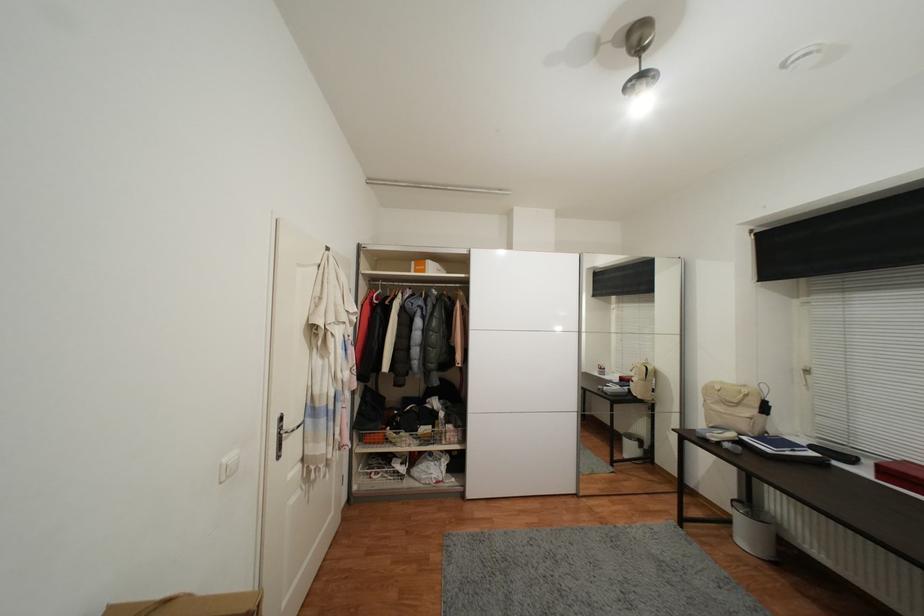
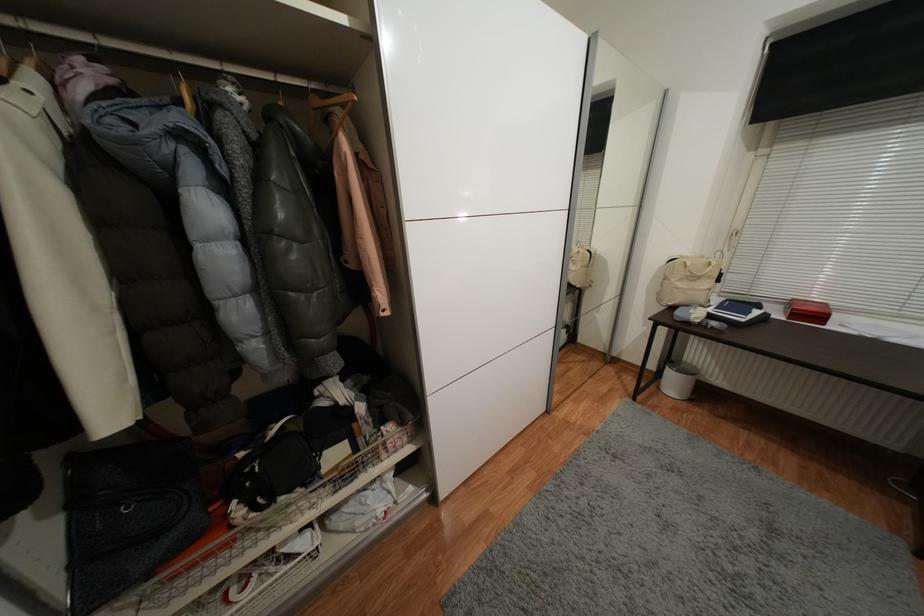
In the second image, find the point that corresponds to the point at 424,446 in the first image.

(342, 493)